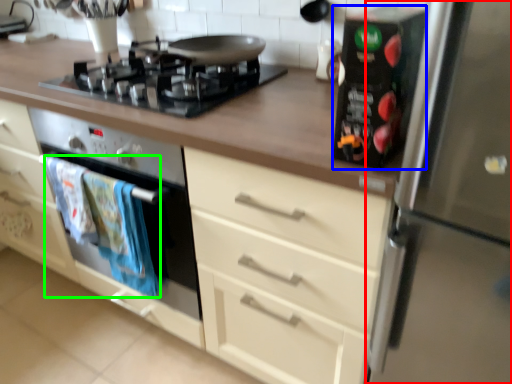
Question: Considering the real-world distances, which object is farthest from refrigerator (highlighted by a red box)? appliance (highlighted by a blue box) or material (highlighted by a green box)?

Choices:
 (A) appliance
 (B) material

Answer: (B)